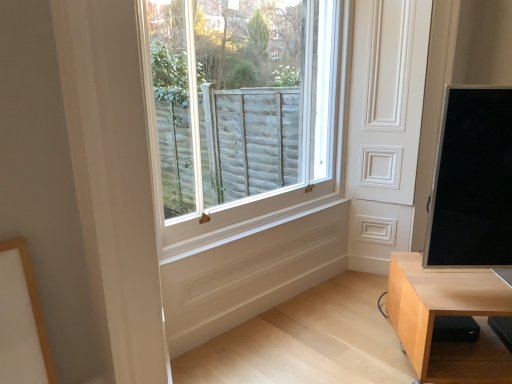
Question: Can you confirm if white wooden window at center is shorter than black glossy screen at right?

Choices:
 (A) no
 (B) yes

Answer: (A)

Question: Is white wooden window at center thinner than black glossy screen at right?

Choices:
 (A) yes
 (B) no

Answer: (A)

Question: Is white wooden window at center bigger than black glossy screen at right?

Choices:
 (A) yes
 (B) no

Answer: (A)

Question: Is white wooden window at center wider than black glossy screen at right?

Choices:
 (A) yes
 (B) no

Answer: (B)

Question: Are white wooden window at center and black glossy screen at right far apart?

Choices:
 (A) no
 (B) yes

Answer: (B)

Question: Would you say white wooden window at center is to the left or to the right of light wood table at lower right in the picture?

Choices:
 (A) left
 (B) right

Answer: (A)

Question: Is point (221, 226) positioned closer to the camera than point (415, 278)?

Choices:
 (A) farther
 (B) closer

Answer: (A)

Question: Which is correct: white wooden window at center is inside light wood table at lower right, or outside of it?

Choices:
 (A) inside
 (B) outside

Answer: (B)

Question: From their relative heights in the image, would you say white wooden window at center is taller or shorter than light wood table at lower right?

Choices:
 (A) short
 (B) tall

Answer: (B)

Question: From a real-world perspective, is light wood table at lower right physically located above or below black glossy screen at right?

Choices:
 (A) below
 (B) above

Answer: (A)

Question: Based on their sizes in the image, would you say light wood table at lower right is bigger or smaller than black glossy screen at right?

Choices:
 (A) small
 (B) big

Answer: (B)

Question: Considering their positions, is light wood table at lower right located in front of or behind black glossy screen at right?

Choices:
 (A) front
 (B) behind

Answer: (B)

Question: Is light wood table at lower right spatially inside black glossy screen at right, or outside of it?

Choices:
 (A) inside
 (B) outside

Answer: (B)

Question: From the image's perspective, is black glossy screen at right located above or below white wooden window at center?

Choices:
 (A) above
 (B) below

Answer: (B)

Question: Looking at the image, does black glossy screen at right seem bigger or smaller compared to white wooden window at center?

Choices:
 (A) small
 (B) big

Answer: (A)